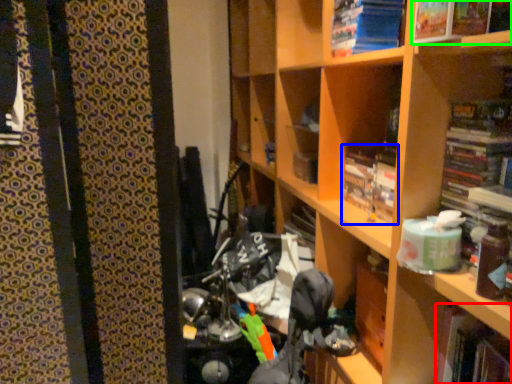
Question: Estimate the real-world distances between objects in this image. Which object is farther from book (highlighted by a red box), book (highlighted by a blue box) or book (highlighted by a green box)?

Choices:
 (A) book
 (B) book

Answer: (B)